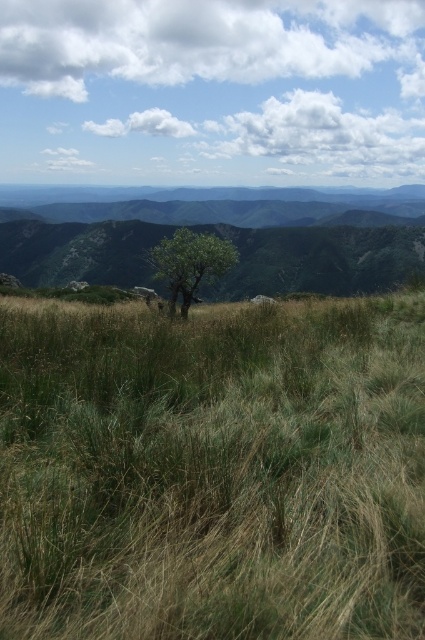
Question: Can you confirm if green grassy hill at center is bigger than green leafy tree at center?

Choices:
 (A) no
 (B) yes

Answer: (B)

Question: Considering the real-world distances, which object is closest to the green grassy at center?

Choices:
 (A) green grassy hill at center
 (B) green leafy tree at center

Answer: (B)

Question: Does green grassy at center appear on the right side of green grassy hill at center?

Choices:
 (A) no
 (B) yes

Answer: (A)

Question: Among these objects, which one is nearest to the camera?

Choices:
 (A) green grassy at center
 (B) green grassy hill at center

Answer: (A)

Question: Considering the relative positions of green grassy at center and green leafy tree at center in the image provided, where is green grassy at center located with respect to green leafy tree at center?

Choices:
 (A) right
 (B) left

Answer: (A)

Question: Which point appears farthest from the camera in this image?

Choices:
 (A) (266, 195)
 (B) (172, 298)

Answer: (A)